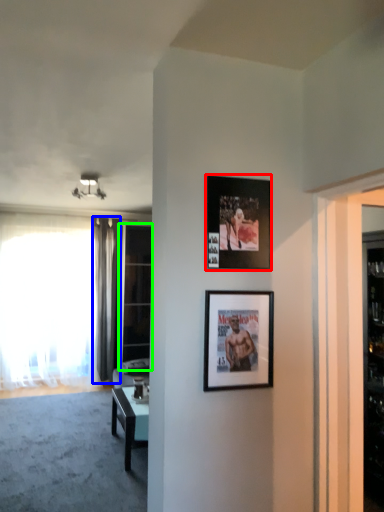
Question: Which object is the farthest from picture frame (highlighted by a red box)? Choose among these: curtain (highlighted by a blue box) or glass door (highlighted by a green box).

Choices:
 (A) curtain
 (B) glass door

Answer: (A)